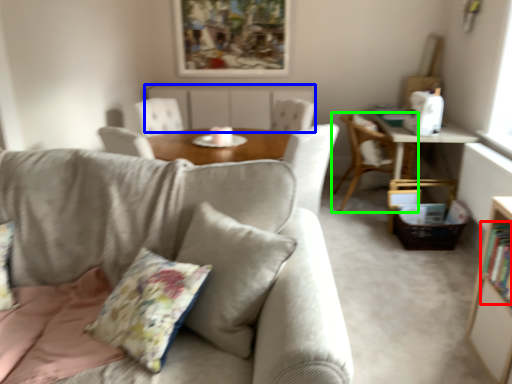
Question: Based on their relative distances, which object is farther from book (highlighted by a red box)? Choose from beige (highlighted by a blue box) and chair (highlighted by a green box).

Choices:
 (A) beige
 (B) chair

Answer: (A)